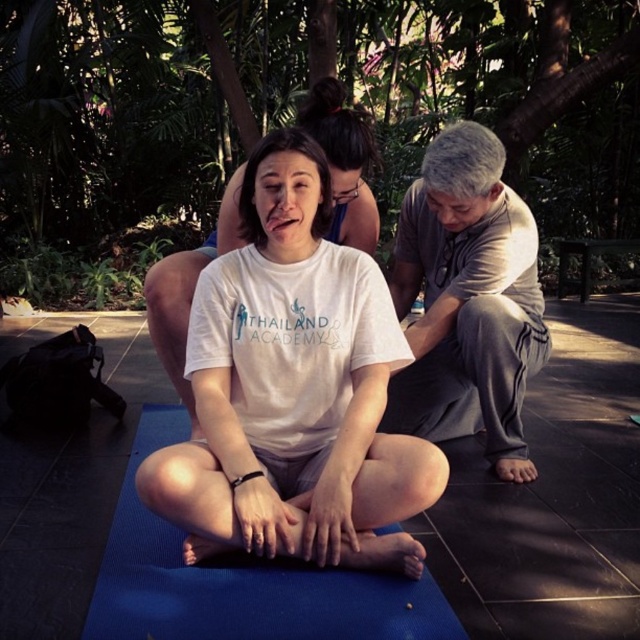
Question: Which object is closer to the camera taking this photo?

Choices:
 (A) gray cotton shirt at upper right
 (B) blue rubber yoga mat at center
 (C) white cotton t-shirt at center

Answer: (B)

Question: Is white cotton t-shirt at center positioned at the back of gray cotton shirt at upper right?

Choices:
 (A) yes
 (B) no

Answer: (B)

Question: Which of these objects is positioned closest to the white cotton t-shirt at center?

Choices:
 (A) gray cotton shirt at upper right
 (B) blue rubber yoga mat at center

Answer: (B)

Question: Among these objects, which one is nearest to the camera?

Choices:
 (A) white cotton t-shirt at center
 (B) blue rubber yoga mat at center
 (C) gray cotton shirt at upper right

Answer: (B)

Question: Observing the image, what is the correct spatial positioning of white cotton t-shirt at center in reference to gray cotton shirt at upper right?

Choices:
 (A) right
 (B) left

Answer: (B)

Question: Is gray cotton shirt at upper right bigger than blue rubber yoga mat at center?

Choices:
 (A) yes
 (B) no

Answer: (B)